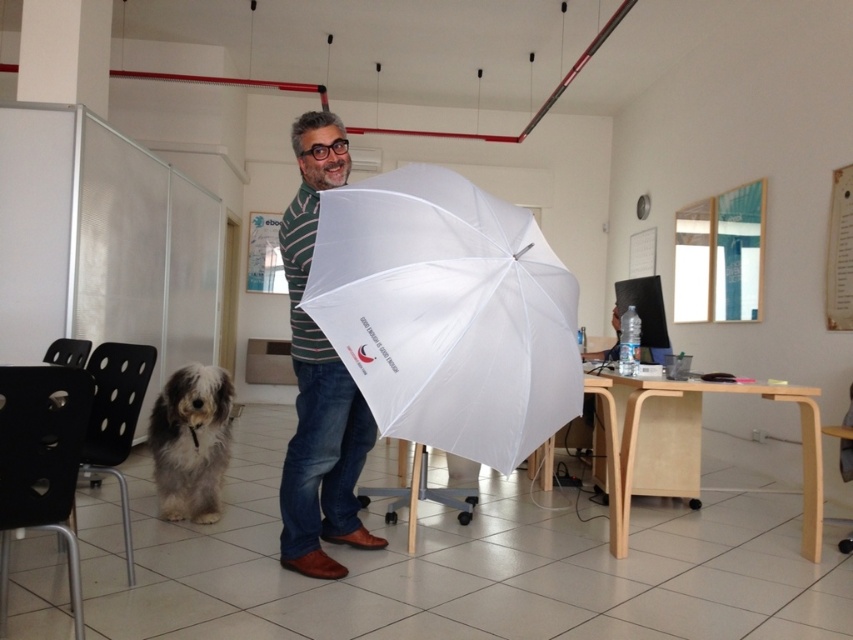
Can you confirm if white matte umbrella at center is smaller than fuzzy gray dog at lower left?

Incorrect, white matte umbrella at center is not smaller in size than fuzzy gray dog at lower left.

Between white matte umbrella at center and fuzzy gray dog at lower left, which one appears on the left side from the viewer's perspective?

fuzzy gray dog at lower left is more to the left.

This screenshot has width=853, height=640. What are the coordinates of `white matte umbrella at center` in the screenshot? It's located at (445, 314).

Does point (346, 228) come in front of point (291, 486)?

That is True.

Identify the location of white matte umbrella at center. The image size is (853, 640). (445, 314).

Image resolution: width=853 pixels, height=640 pixels. I want to click on white matte umbrella at center, so click(x=445, y=314).

Does striped cotton shirt at center appear over fuzzy gray dog at lower left?

Yes.

Between striped cotton shirt at center and fuzzy gray dog at lower left, which one is positioned lower?

fuzzy gray dog at lower left

What are the coordinates of `striped cotton shirt at center` in the screenshot? It's located at (318, 380).